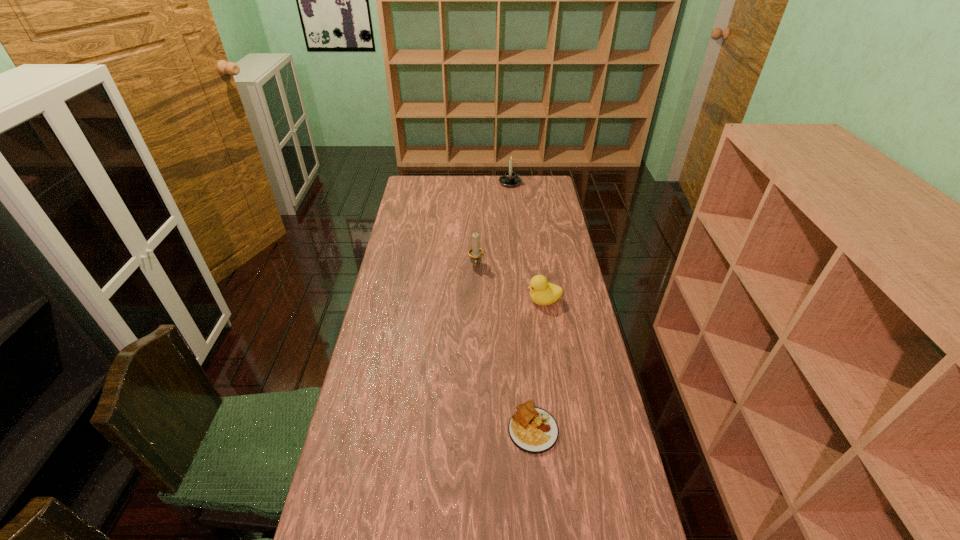
The image size is (960, 540). Identify the location of free space between the nearest object and the nearer candle holder. (505, 347).

Image resolution: width=960 pixels, height=540 pixels. Identify the location of vacant point located between the left candle holder and the omelet. (505, 347).

Locate an element on the screen. The width and height of the screenshot is (960, 540). blank region between the farthest object and the nearest object is located at coordinates (521, 305).

This screenshot has height=540, width=960. I want to click on vacant point located between the left candle holder and the nearest object, so click(505, 347).

This screenshot has height=540, width=960. In order to click on vacant area between the right candle holder and the omelet in this screenshot , I will do `click(521, 305)`.

Where is `empty space that is in between the right candle holder and the second farthest object`? empty space that is in between the right candle holder and the second farthest object is located at coordinates (493, 224).

You are a GUI agent. You are given a task and a screenshot of the screen. Output one action in this format:
    pyautogui.click(x=<x>, y=<y>)
    Task: Click on the free space that is in between the left candle holder and the farther candle holder
    The height and width of the screenshot is (540, 960).
    Given the screenshot: What is the action you would take?
    pyautogui.click(x=493, y=224)

This screenshot has width=960, height=540. I want to click on vacant area that lies between the left candle holder and the third tallest object, so click(510, 283).

At what (x,y) coordinates should I click in order to perform the action: click on vacant space that is in between the left candle holder and the farther candle holder. Please return your answer as a coordinate pair (x, y). The width and height of the screenshot is (960, 540). Looking at the image, I should click on (493, 224).

Locate an element on the screen. vacant region between the omelet and the nearer candle holder is located at coordinates (505, 347).